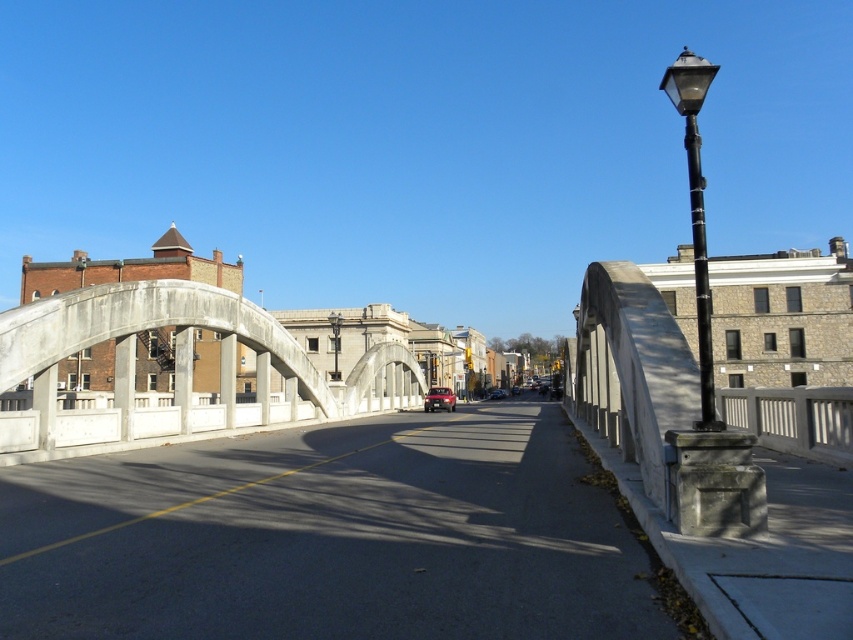
The image size is (853, 640). What do you see at coordinates (439, 400) in the screenshot?
I see `shiny red car at center` at bounding box center [439, 400].

Is the position of shiny red car at center more distant than that of black polished metal streetlight at center?

No.

Locate an element on the screen. The height and width of the screenshot is (640, 853). shiny red car at center is located at coordinates (439, 400).

Locate an element on the screen. This screenshot has height=640, width=853. shiny red car at center is located at coordinates pos(439,400).

How much distance is there between black metal streetlight at right and matte red car at center?

black metal streetlight at right and matte red car at center are 307.12 feet apart from each other.

Is point (701, 308) closer to camera compared to point (502, 394)?

Yes.

Locate an element on the screen. black metal streetlight at right is located at coordinates (695, 211).

Identify the location of black metal streetlight at right. Image resolution: width=853 pixels, height=640 pixels. (695, 211).

Is concrete bridge at center positioned at the back of shiny red car at center?

No, it is in front of shiny red car at center.

Is concrete bridge at center bigger than shiny red car at center?

Indeed, concrete bridge at center has a larger size compared to shiny red car at center.

Image resolution: width=853 pixels, height=640 pixels. In order to click on concrete bridge at center in this screenshot , I will do `click(173, 365)`.

Where is `concrete bridge at center`? This screenshot has width=853, height=640. concrete bridge at center is located at coordinates (173, 365).